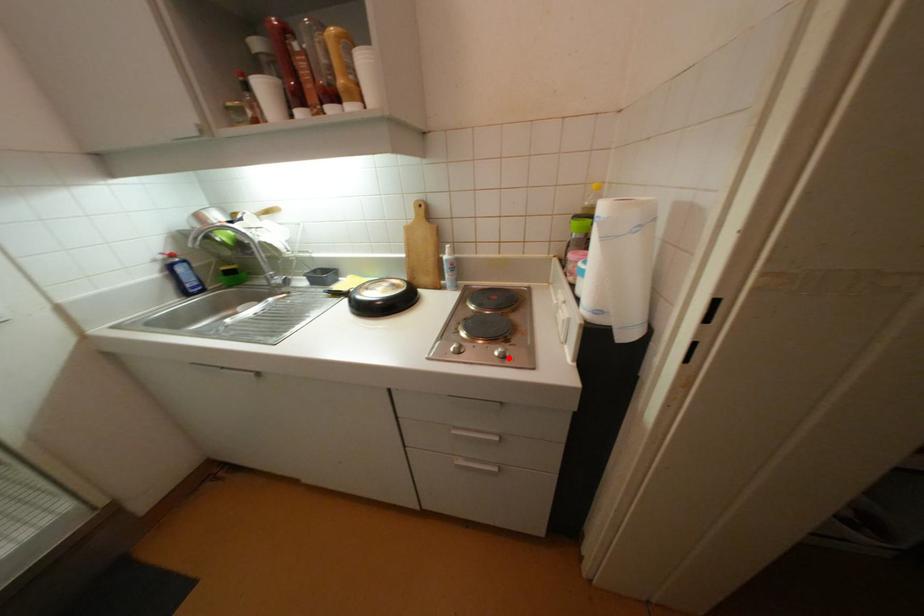
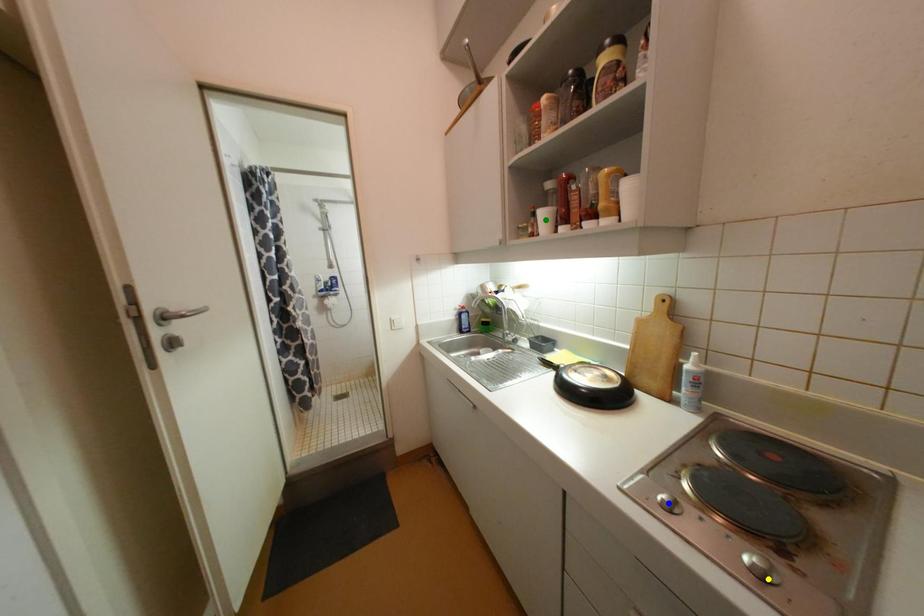
Question: I am providing you with two images of the same scene from different viewpoints. A red point is marked on the first image. You are given multiple points on the second image. Which point in image 2 represents the same 3d spot as the red point in image 1?

Choices:
 (A) yellow point
 (B) green point
 (C) blue point

Answer: (A)